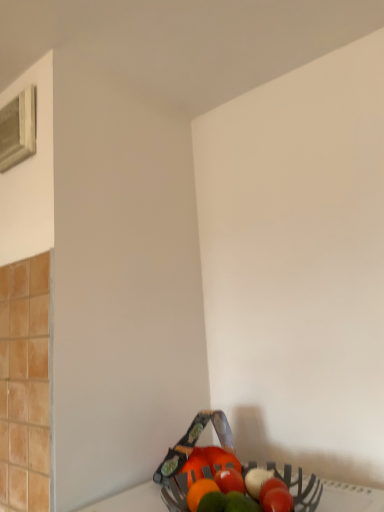
Locate an element on the screen. white wood window at upper left is located at coordinates (18, 129).

The width and height of the screenshot is (384, 512). What do you see at coordinates (18, 129) in the screenshot?
I see `white wood window at upper left` at bounding box center [18, 129].

The image size is (384, 512). What do you see at coordinates (349, 497) in the screenshot? I see `metallic basket at lower right` at bounding box center [349, 497].

Identify the location of metallic basket at lower right. pyautogui.click(x=349, y=497).

The height and width of the screenshot is (512, 384). What are the coordinates of `white wood window at upper left` in the screenshot? It's located at (18, 129).

Which is more to the right, metallic basket at lower right or white wood window at upper left?

metallic basket at lower right.

Is the position of metallic basket at lower right more distant than that of white wood window at upper left?

No, metallic basket at lower right is in front of white wood window at upper left.

Which is behind, point (126, 504) or point (4, 129)?

The point (4, 129) is more distant.

From the image's perspective, is metallic basket at lower right located above or below white wood window at upper left?

From the image's perspective, metallic basket at lower right appears below white wood window at upper left.

From a real-world perspective, which object stands above the other?

white wood window at upper left is physically above.

Considering the sizes of metallic basket at lower right and white wood window at upper left in the image, is metallic basket at lower right wider or thinner than white wood window at upper left?

Considering their sizes, metallic basket at lower right looks broader than white wood window at upper left.

Who is shorter, metallic basket at lower right or white wood window at upper left?

metallic basket at lower right.

Between metallic basket at lower right and white wood window at upper left, which one has smaller size?

With smaller size is white wood window at upper left.

Is metallic basket at lower right located outside white wood window at upper left?

Yes, metallic basket at lower right is not within white wood window at upper left.

In the scene shown: Is there a large distance between metallic basket at lower right and white wood window at upper left?

Indeed, metallic basket at lower right is not near white wood window at upper left.

Is white wood window at upper left at the back of metallic basket at lower right?

That's not correct — metallic basket at lower right is not looking away from white wood window at upper left.

Can you tell me how much metallic basket at lower right and white wood window at upper left differ in facing direction?

The angular difference between metallic basket at lower right and white wood window at upper left is 2.48 degrees.

You are a GUI agent. You are given a task and a screenshot of the screen. Output one action in this format:
    pyautogui.click(x=<x>, y=<y>)
    Task: Click on the table top in front of the white wood window at upper left
    
    Given the screenshot: What is the action you would take?
    pyautogui.click(x=349, y=497)

Between white wood window at upper left and metallic basket at lower right, which one appears on the left side from the viewer's perspective?

Positioned to the left is white wood window at upper left.

Is white wood window at upper left positioned before metallic basket at lower right?

No, it is behind metallic basket at lower right.

Is point (8, 119) closer to viewer compared to point (322, 493)?

No, (8, 119) is further to viewer.

From the image's perspective, which is above, white wood window at upper left or metallic basket at lower right?

white wood window at upper left is shown above in the image.

From a real-world perspective, is white wood window at upper left physically located above or below metallic basket at lower right?

white wood window at upper left is situated higher than metallic basket at lower right in the real world.

Based on the photo, in terms of width, does white wood window at upper left look wider or thinner when compared to metallic basket at lower right?

white wood window at upper left is thinner than metallic basket at lower right.

Considering the sizes of objects white wood window at upper left and metallic basket at lower right in the image provided, who is taller, white wood window at upper left or metallic basket at lower right?

white wood window at upper left.

Does white wood window at upper left have a larger size compared to metallic basket at lower right?

No, white wood window at upper left is not bigger than metallic basket at lower right.

Is white wood window at upper left positioned beyond the bounds of metallic basket at lower right?

Yes.

Can you see white wood window at upper left touching metallic basket at lower right?

No.

Could you tell me if white wood window at upper left is turned towards metallic basket at lower right?

No, white wood window at upper left is not turned towards metallic basket at lower right.

Can you tell me how much white wood window at upper left and metallic basket at lower right differ in facing direction?

white wood window at upper left and metallic basket at lower right are facing 2.48 degrees away from each other.

How distant is white wood window at upper left from metallic basket at lower right?

They are 1.14 meters apart.

This screenshot has width=384, height=512. In order to click on window that appears above the metallic basket at lower right (from a real-world perspective) in this screenshot , I will do `click(18, 129)`.

This screenshot has width=384, height=512. What are the coordinates of `window above the metallic basket at lower right (from the image's perspective)` in the screenshot? It's located at coord(18,129).

You are a GUI agent. You are given a task and a screenshot of the screen. Output one action in this format:
    pyautogui.click(x=<x>, y=<y>)
    Task: Click on the window behind the metallic basket at lower right
    
    Given the screenshot: What is the action you would take?
    pyautogui.click(x=18, y=129)